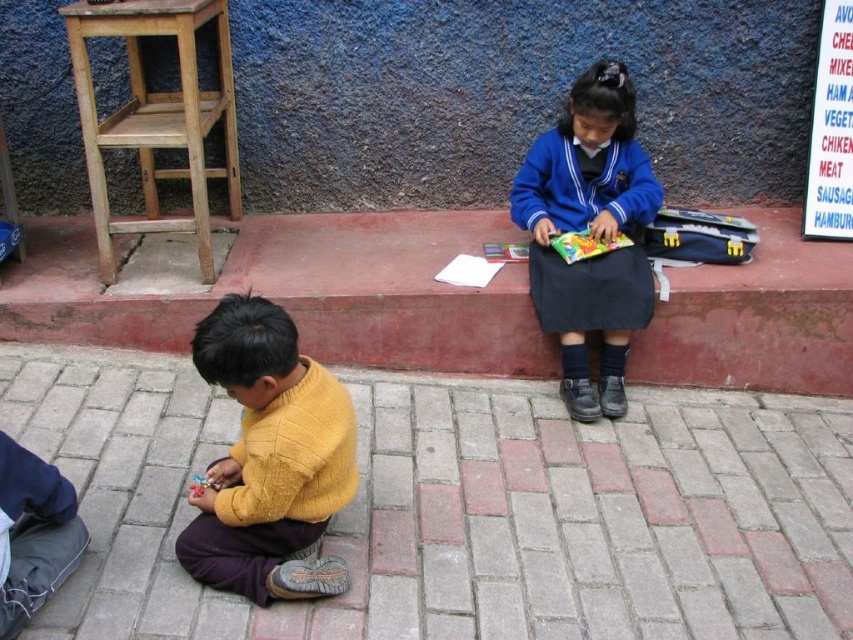
Question: Is blue fabric uniform at center smaller than wooden stool at left?

Choices:
 (A) no
 (B) yes

Answer: (B)

Question: Does yellow knitted sweater at lower left appear over wooden stool at left?

Choices:
 (A) yes
 (B) no

Answer: (B)

Question: Based on their relative distances, which object is farther from the wooden stool at left?

Choices:
 (A) brick at lower center
 (B) blue fabric uniform at center
 (C) brick pavement at lower center
 (D) yellow knitted sweater at lower left

Answer: (B)

Question: Is blue fabric uniform at center thinner than wooden stool at left?

Choices:
 (A) yes
 (B) no

Answer: (A)

Question: Which point is farther to the camera?

Choices:
 (A) blue fabric uniform at center
 (B) brick at lower center
 (C) yellow knitted sweater at lower left

Answer: (B)

Question: Which point is farther from the camera taking this photo?

Choices:
 (A) (68, 404)
 (B) (309, 477)
 (C) (561, 166)
 (D) (352, 305)

Answer: (C)